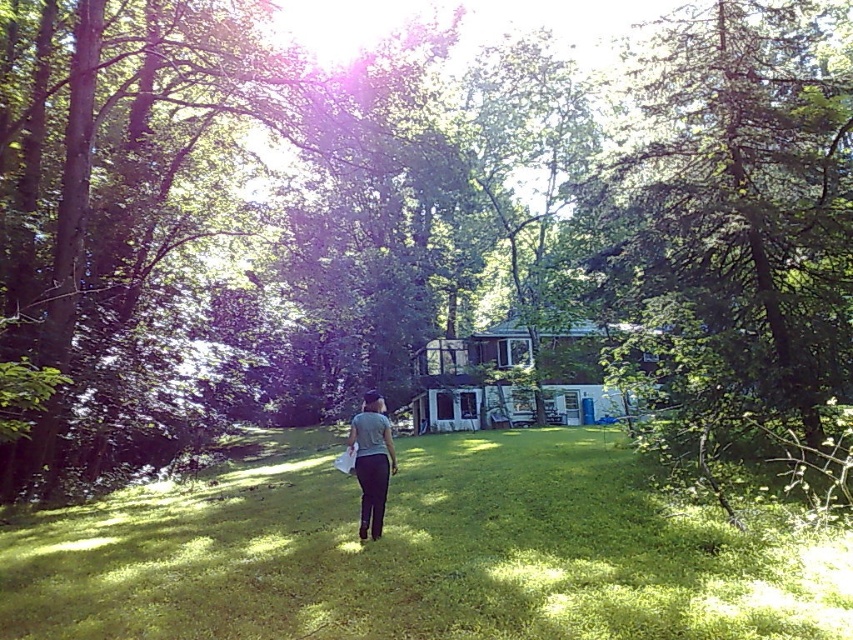
Question: Observing the image, what is the correct spatial positioning of green grassy lawn at center in reference to gray matte shirt at center?

Choices:
 (A) right
 (B) left

Answer: (B)

Question: Can you confirm if green grassy lawn at center is positioned below gray matte shirt at center?

Choices:
 (A) yes
 (B) no

Answer: (A)

Question: Among these objects, which one is nearest to the camera?

Choices:
 (A) gray matte shirt at center
 (B) green grassy lawn at center

Answer: (B)

Question: Is green grassy lawn at center in front of gray matte shirt at center?

Choices:
 (A) yes
 (B) no

Answer: (A)